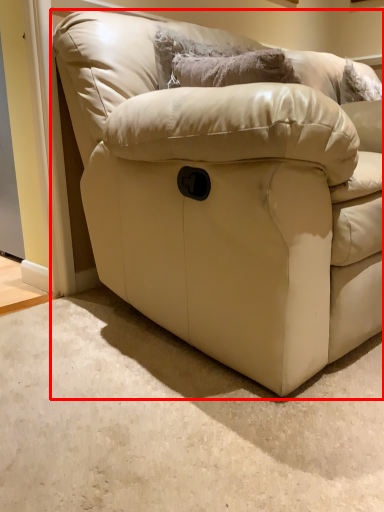
Question: From the image's perspective, what is the correct spatial relationship of studio couch (annotated by the red box) in relation to pillow?

Choices:
 (A) above
 (B) below

Answer: (B)